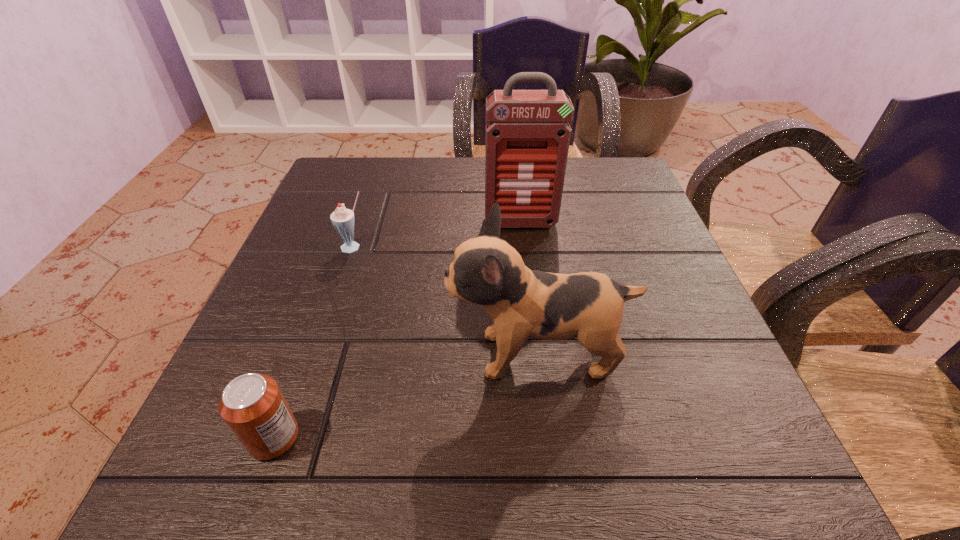
You are a GUI agent. You are given a task and a screenshot of the screen. Output one action in this format:
    pyautogui.click(x=<x>, y=<y>)
    Task: Click on the vacant space at the right edge
    
    Given the screenshot: What is the action you would take?
    pyautogui.click(x=705, y=342)

Image resolution: width=960 pixels, height=540 pixels. In the image, there is a desktop. In order to click on vacant space at the far left corner in this screenshot , I will do `click(350, 165)`.

I want to click on vacant space at the near left corner, so click(222, 484).

Image resolution: width=960 pixels, height=540 pixels. Find the location of `vacant area at the far right corner`. vacant area at the far right corner is located at coordinates (580, 174).

This screenshot has height=540, width=960. I want to click on free point between the can and the third shortest object, so click(405, 396).

Find the location of `free space between the puppy and the can`. free space between the puppy and the can is located at coordinates (405, 396).

This screenshot has width=960, height=540. I want to click on free area in between the farthest object and the can, so click(x=397, y=330).

This screenshot has width=960, height=540. In order to click on free space between the tallest object and the nearest object in this screenshot , I will do `click(397, 330)`.

At what (x,y) coordinates should I click in order to perform the action: click on free area in between the first-aid kit and the can. Please return your answer as a coordinate pair (x, y). This screenshot has height=540, width=960. Looking at the image, I should click on (397, 330).

Image resolution: width=960 pixels, height=540 pixels. Identify the location of vacant space in between the second nearest object and the can. (405, 396).